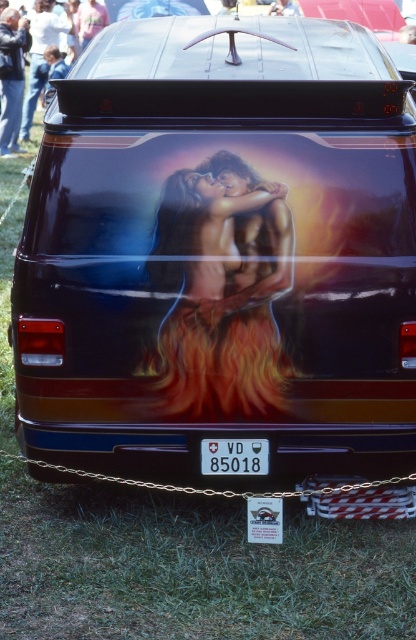
Is point (240, 284) behind point (244, 451)?

That is False.

Is the position of flaming orange hair at center less distant than that of white plastic license plate at center?

That is True.

Which is behind, point (158, 237) or point (232, 444)?

Point (232, 444)

The image size is (416, 640). Identify the location of flaming orange hair at center. (220, 291).

Is point (151, 252) less distant than point (12, 100)?

Yes, point (151, 252) is in front of point (12, 100).

Is point (210, 227) less distant than point (9, 113)?

That is True.

The width and height of the screenshot is (416, 640). In order to click on flaming orange hair at center in this screenshot , I will do `click(220, 291)`.

Which is above, dark blue jeans at upper left or white plastic license plate at center?

dark blue jeans at upper left is above.

Does dark blue jeans at upper left appear on the left side of white plastic license plate at center?

Yes, dark blue jeans at upper left is to the left of white plastic license plate at center.

Measure the distance between dark blue jeans at upper left and camera.

dark blue jeans at upper left and camera are 13.82 meters apart from each other.

At what (x,y) coordinates should I click in order to perform the action: click on dark blue jeans at upper left. Please return your answer as a coordinate pair (x, y). Looking at the image, I should click on (10, 77).